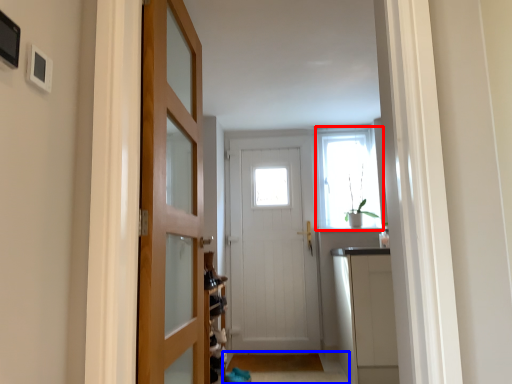
Question: Which object appears closest to the camera in this image, window (highlighted by a red box) or path (highlighted by a blue box)?

Choices:
 (A) window
 (B) path

Answer: (B)